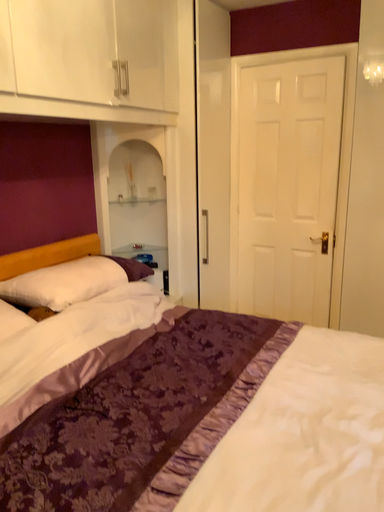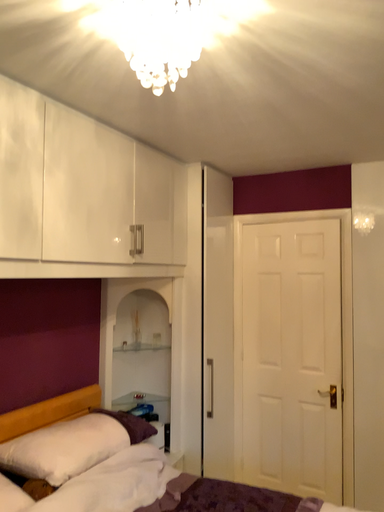
Question: Which way did the camera rotate in the video?

Choices:
 (A) rotated upward
 (B) rotated downward

Answer: (A)